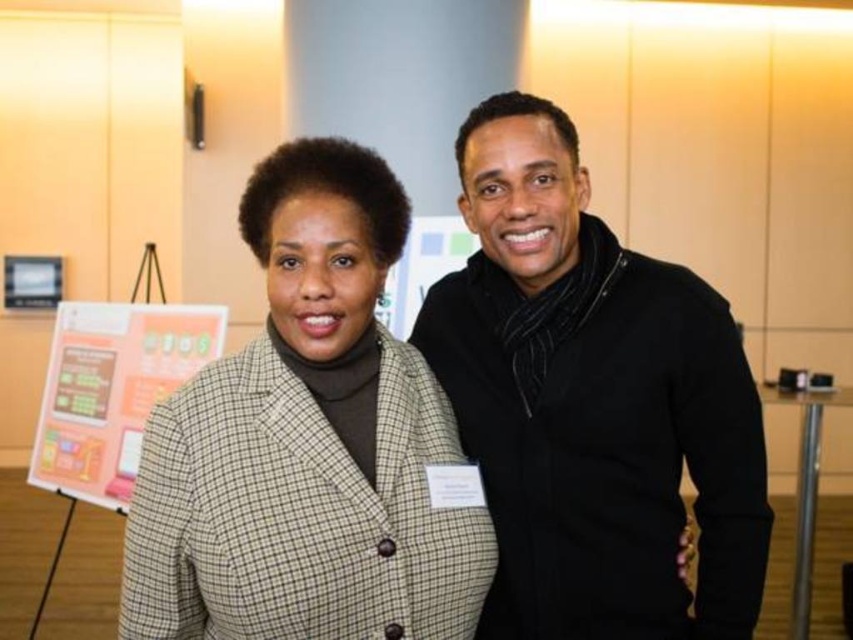
Between checkered wool blazer at center and orange paperboard at left, which one appears on the right side from the viewer's perspective?

checkered wool blazer at center

Is checkered wool blazer at center to the right of orange paperboard at left from the viewer's perspective?

Yes, checkered wool blazer at center is to the right of orange paperboard at left.

Does point (312, 432) come closer to viewer compared to point (68, 394)?

That is True.

Where is `checkered wool blazer at center`? checkered wool blazer at center is located at coordinates (306, 444).

Describe the element at coordinates (592, 403) in the screenshot. I see `black matte sweater at center` at that location.

Can you confirm if black matte sweater at center is bigger than checkered wool blazer at center?

Correct, black matte sweater at center is larger in size than checkered wool blazer at center.

Find the location of a particular element. Image resolution: width=853 pixels, height=640 pixels. black matte sweater at center is located at coordinates (592, 403).

How distant is black matte sweater at center from orange paperboard at left?

black matte sweater at center is 1.28 meters from orange paperboard at left.

Is point (563, 369) positioned after point (94, 461)?

That is False.

Identify the location of black matte sweater at center. (592, 403).